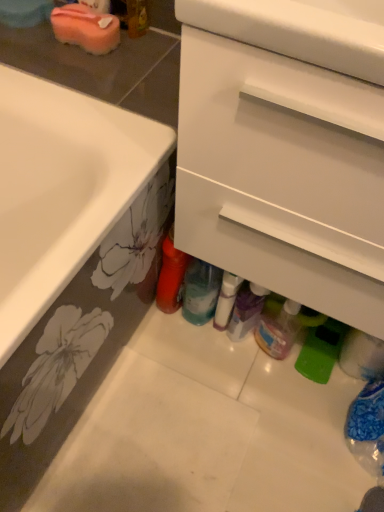
Question: Can you confirm if translucent plastic bottle at lower center, which is counted as the first bottle, starting from the right, is positioned to the left of pink sponge at upper left?

Choices:
 (A) no
 (B) yes

Answer: (A)

Question: Does translucent plastic bottle at lower center, acting as the 4th bottle starting from the left, appear on the right side of pink sponge at upper left?

Choices:
 (A) no
 (B) yes

Answer: (B)

Question: Could you tell me if translucent plastic bottle at lower center, which is counted as the first bottle, starting from the right, is turned towards pink sponge at upper left?

Choices:
 (A) yes
 (B) no

Answer: (B)

Question: Can you confirm if translucent plastic bottle at lower center, acting as the 4th bottle starting from the left, is shorter than pink sponge at upper left?

Choices:
 (A) yes
 (B) no

Answer: (B)

Question: From the image's perspective, is translucent plastic bottle at lower center, acting as the 4th bottle starting from the left, on pink sponge at upper left?

Choices:
 (A) no
 (B) yes

Answer: (A)

Question: From their relative heights in the image, would you say translucent plastic bottle at center, the first bottle positioned from the left, is taller or shorter than translucent plastic bottle at lower center, the third bottle when ordered from right to left?

Choices:
 (A) tall
 (B) short

Answer: (A)

Question: Based on their sizes in the image, would you say translucent plastic bottle at center, which is the fourth bottle in right-to-left order, is bigger or smaller than translucent plastic bottle at lower center, the third bottle when ordered from right to left?

Choices:
 (A) small
 (B) big

Answer: (B)

Question: From a real-world perspective, is translucent plastic bottle at center, the first bottle positioned from the left, physically located above or below translucent plastic bottle at lower center, positioned as the second bottle in left-to-right order?

Choices:
 (A) below
 (B) above

Answer: (B)

Question: Does point (168, 248) appear closer or farther from the camera than point (213, 311)?

Choices:
 (A) closer
 (B) farther

Answer: (A)

Question: Considering the positions of white glossy bottle at center, which ranks as the 3th bottle in left-to-right order, and translucent plastic bottle at center, which is the fourth bottle in right-to-left order, in the image, is white glossy bottle at center, which ranks as the 3th bottle in left-to-right order, taller or shorter than translucent plastic bottle at center, which is the fourth bottle in right-to-left order,?

Choices:
 (A) short
 (B) tall

Answer: (A)

Question: From a real-world perspective, is white glossy bottle at center, placed as the 2th bottle when sorted from right to left, positioned above or below translucent plastic bottle at center, which is the fourth bottle in right-to-left order?

Choices:
 (A) below
 (B) above

Answer: (A)

Question: Looking at their shapes, would you say white glossy bottle at center, which ranks as the 3th bottle in left-to-right order, is wider or thinner than translucent plastic bottle at center, the first bottle positioned from the left?

Choices:
 (A) thin
 (B) wide

Answer: (A)

Question: Considering the relative positions of white glossy bottle at center, which ranks as the 3th bottle in left-to-right order, and translucent plastic bottle at center, which is the fourth bottle in right-to-left order, in the image provided, is white glossy bottle at center, which ranks as the 3th bottle in left-to-right order, to the left or to the right of translucent plastic bottle at center, which is the fourth bottle in right-to-left order,?

Choices:
 (A) right
 (B) left

Answer: (A)

Question: Visually, is white glossy bottle at center, which ranks as the 3th bottle in left-to-right order, positioned to the left or to the right of translucent plastic bottle at lower center, positioned as the second bottle in left-to-right order?

Choices:
 (A) left
 (B) right

Answer: (B)

Question: From the image's perspective, is white glossy bottle at center, which ranks as the 3th bottle in left-to-right order, positioned above or below translucent plastic bottle at lower center, the third bottle when ordered from right to left?

Choices:
 (A) below
 (B) above

Answer: (A)